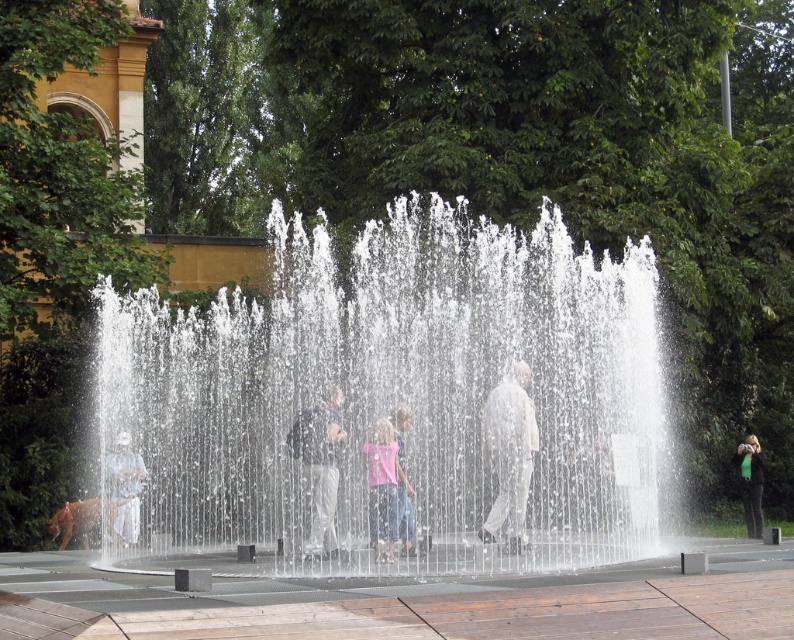
Question: Where is light blue jeans at center located in relation to white fabric statue at center in the image?

Choices:
 (A) above
 (B) below

Answer: (A)

Question: Which of the following is the closest to the observer?

Choices:
 (A) (310, 520)
 (B) (307, 388)
 (C) (372, 435)

Answer: (C)

Question: Is clear water at center bigger than green fabric bag at right?

Choices:
 (A) no
 (B) yes

Answer: (B)

Question: Which of the following is the farthest from the observer?

Choices:
 (A) (110, 499)
 (B) (758, 490)

Answer: (B)

Question: Observing the image, what is the correct spatial positioning of light blue jeans at center in reference to pink cotton shirt at center?

Choices:
 (A) left
 (B) right

Answer: (A)

Question: Which point appears closest to the camera in this image?

Choices:
 (A) (326, 534)
 (B) (197, 516)
 (C) (742, 472)

Answer: (A)